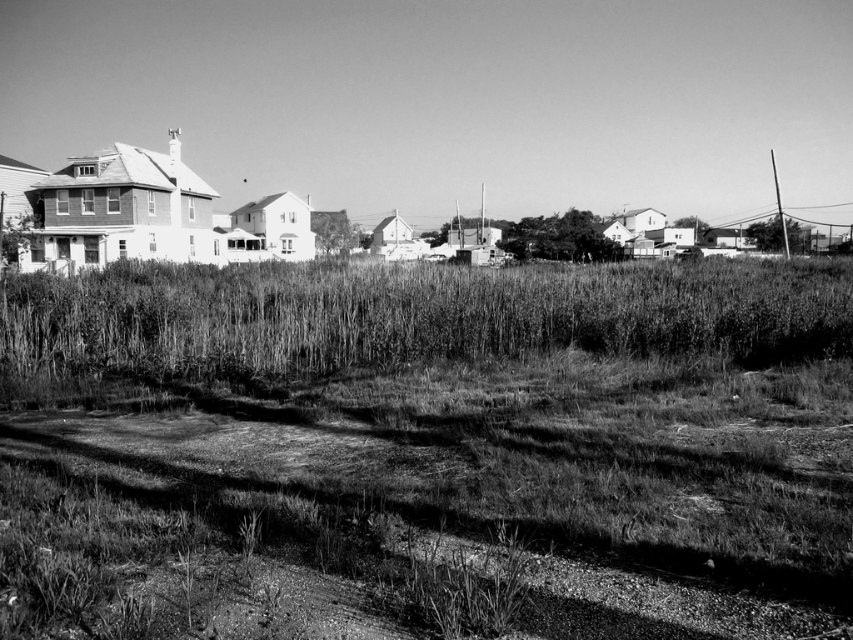
Does dirt/gravel track at lower center have a larger size compared to grassy field at center?

No.

Who is positioned more to the right, dirt/gravel track at lower center or grassy field at center?

Positioned to the right is grassy field at center.

Image resolution: width=853 pixels, height=640 pixels. Find the location of `dirt/gravel track at lower center`. dirt/gravel track at lower center is located at coordinates (440, 504).

The height and width of the screenshot is (640, 853). I want to click on dirt/gravel track at lower center, so click(440, 504).